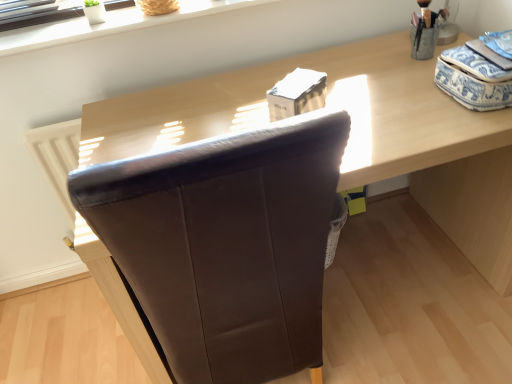
Locate an element on the screen. The height and width of the screenshot is (384, 512). brown leather chair at center is located at coordinates (351, 136).

Image resolution: width=512 pixels, height=384 pixels. In order to click on white smooth window sill at upper center in this screenshot , I will do `click(110, 25)`.

Identify the location of brown leather chair at center. (225, 245).

I want to click on brown leather chair at center, so click(351, 136).

Which of these two, brown leather chair at center or white smooth window sill at upper center, stands shorter?

With less height is white smooth window sill at upper center.

Which object is positioned more to the right, brown leather chair at center or white smooth window sill at upper center?

brown leather chair at center is more to the right.

From a real-world perspective, is brown leather chair at center located beneath white smooth window sill at upper center?

Yes, from a real-world perspective, brown leather chair at center is below white smooth window sill at upper center.

Which of these two, brown leather chair at center or white smooth window sill at upper center, is smaller?

Smaller between the two is white smooth window sill at upper center.

Which is correct: white smooth window sill at upper center is inside brown leather chair at center, or outside of it?

white smooth window sill at upper center exists outside the volume of brown leather chair at center.

Could you tell me if white smooth window sill at upper center is facing brown leather chair at center?

Yes.

Who is bigger, white smooth window sill at upper center or brown leather chair at center?

brown leather chair at center.

From a real-world perspective, relative to brown leather chair at center, is brown leather chair at center vertically above or below?

From a real-world perspective, brown leather chair at center is physically above brown leather chair at center.

Which of these two, brown leather chair at center or brown leather chair at center, is thinner?

Thinner between the two is brown leather chair at center.

How distant is brown leather chair at center from brown leather chair at center?

brown leather chair at center is 16.28 inches away from brown leather chair at center.

Could brown leather chair at center be considered to be inside brown leather chair at center?

Definitely not — brown leather chair at center is not inside brown leather chair at center.

Visually, is brown leather chair at center positioned to the left or to the right of brown leather chair at center?

Clearly, brown leather chair at center is on the right of brown leather chair at center in the image.

Can you tell me how much brown leather chair at center and brown leather chair at center differ in facing direction?

The facing directions of brown leather chair at center and brown leather chair at center are 179 degrees apart.

Would you say brown leather chair at center contains brown leather chair at center?

Indeed, brown leather chair at center is located within brown leather chair at center.

You are a GUI agent. You are given a task and a screenshot of the screen. Output one action in this format:
    pyautogui.click(x=<x>, y=<y>)
    Task: Click on the chair that is on the left side of brown leather chair at center
    
    Given the screenshot: What is the action you would take?
    pyautogui.click(x=225, y=245)

Consider the image. Is brown leather chair at center thinner than white smooth window sill at upper center?

No.

From the image's perspective, which is above, brown leather chair at center or white smooth window sill at upper center?

From the image's view, white smooth window sill at upper center is above.

The image size is (512, 384). In order to click on window sill lying behind the brown leather chair at center in this screenshot , I will do click(110, 25).

Looking at this image, is white smooth window sill at upper center outside of brown leather chair at center?

white smooth window sill at upper center lies outside brown leather chair at center's area.

In the scene shown: From the image's perspective, is white smooth window sill at upper center above or below brown leather chair at center?

white smooth window sill at upper center is situated higher than brown leather chair at center in the image.

From a real-world perspective, is white smooth window sill at upper center physically located above or below brown leather chair at center?

Clearly, from a real-world perspective, white smooth window sill at upper center is above brown leather chair at center.

Where is `computer desk directly beneath the white smooth window sill at upper center (from a real-world perspective)`? The height and width of the screenshot is (384, 512). computer desk directly beneath the white smooth window sill at upper center (from a real-world perspective) is located at coordinates (351, 136).

You are a GUI agent. You are given a task and a screenshot of the screen. Output one action in this format:
    pyautogui.click(x=<x>, y=<y>)
    Task: Click on the window sill above the brown leather chair at center (from a real-world perspective)
    This screenshot has height=384, width=512.
    Given the screenshot: What is the action you would take?
    pyautogui.click(x=110, y=25)

Consider the image. Considering their positions, is white smooth window sill at upper center positioned further to brown leather chair at center than brown leather chair at center?

Among the two, brown leather chair at center is located further to brown leather chair at center.

When comparing their distances from white smooth window sill at upper center, does brown leather chair at center or brown leather chair at center seem closer?

Among the two, brown leather chair at center is located nearer to white smooth window sill at upper center.

Considering their positions, is brown leather chair at center positioned closer to brown leather chair at center than white smooth window sill at upper center?

The object closer to brown leather chair at center is brown leather chair at center.

Considering their positions, is brown leather chair at center positioned closer to brown leather chair at center than white smooth window sill at upper center?

white smooth window sill at upper center lies closer to brown leather chair at center than the other object.

Based on their spatial positions, is brown leather chair at center or brown leather chair at center further from white smooth window sill at upper center?

Among the two, brown leather chair at center is located further to white smooth window sill at upper center.

Looking at the image, which one is located further to brown leather chair at center, white smooth window sill at upper center or brown leather chair at center?

The object further to brown leather chair at center is white smooth window sill at upper center.

Locate an element on the screen. Image resolution: width=512 pixels, height=384 pixels. computer desk between white smooth window sill at upper center and brown leather chair at center from top to bottom is located at coordinates (351, 136).